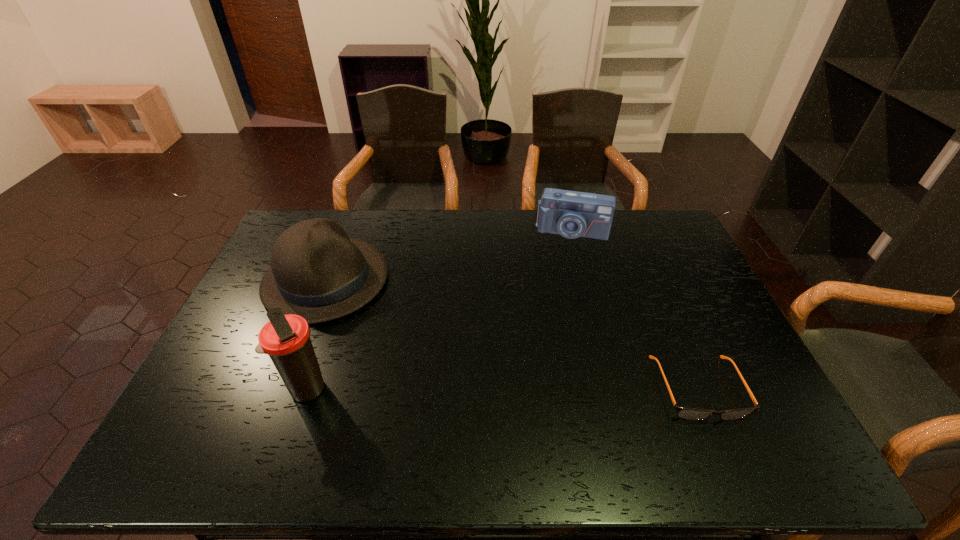
I want to click on free space on the desktop that is between the tallest object and the shortest object and is positioned on the lens of the camera, so click(546, 389).

Identify the location of vacant space on the desktop that is between the tallest object and the shortest object and is positioned on the front-facing side of the second tallest object. (498, 389).